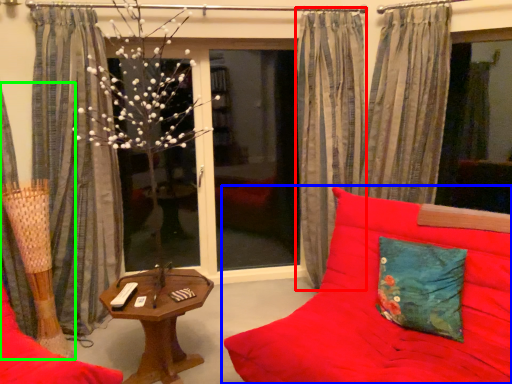
Question: Which is nearer to the curtain (highlighted by a red box)? studio couch (highlighted by a blue box) or curtain (highlighted by a green box).

Choices:
 (A) studio couch
 (B) curtain

Answer: (A)